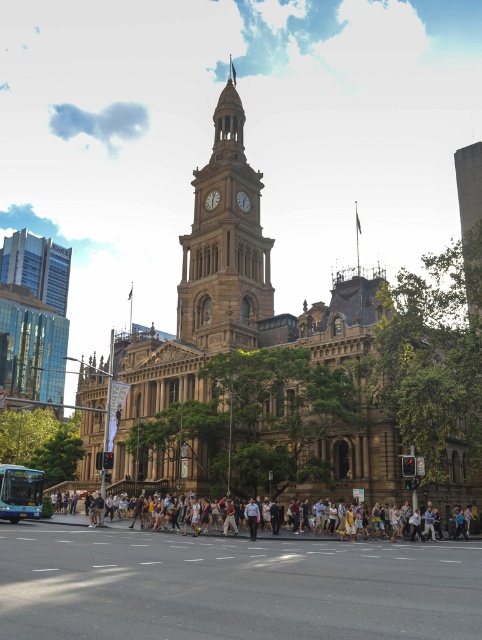
Who is taller, white casual clothing at center or gold metallic clock at center?

With more height is white casual clothing at center.

You are a GUI agent. You are given a task and a screenshot of the screen. Output one action in this format:
    pyautogui.click(x=<x>, y=<y>)
    Task: Click on the white casual clothing at center
    The height and width of the screenshot is (640, 482).
    Given the screenshot: What is the action you would take?
    pyautogui.click(x=451, y=496)

The width and height of the screenshot is (482, 640). I want to click on white casual clothing at center, so click(x=451, y=496).

Does brown stone clock tower at center have a smaller size compared to white glossy clock at center?

Actually, brown stone clock tower at center might be larger than white glossy clock at center.

Measure the distance between brown stone clock tower at center and camera.

The distance of brown stone clock tower at center from camera is 72.82 meters.

This screenshot has width=482, height=640. Find the location of `brown stone clock tower at center`. brown stone clock tower at center is located at coordinates (225, 243).

Can you confirm if white casual clothing at center is bigger than white glossy clock at center?

Yes, white casual clothing at center is bigger than white glossy clock at center.

Can you confirm if white casual clothing at center is thinner than white glossy clock at center?

No.

Which is behind, point (339, 486) or point (217, 193)?

The point (217, 193) is behind.

Where is `white casual clothing at center`? The width and height of the screenshot is (482, 640). white casual clothing at center is located at coordinates (451, 496).